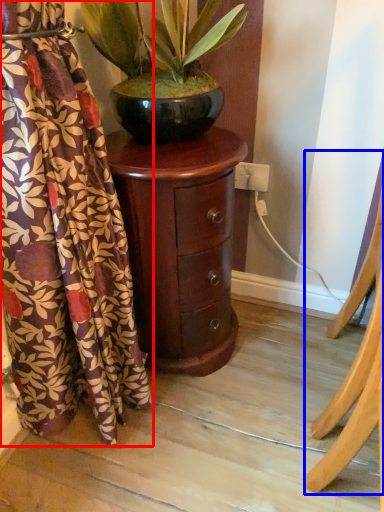
Question: Which point is closer to the camera, curtain (highlighted by a red box) or furniture (highlighted by a blue box)?

Choices:
 (A) curtain
 (B) furniture

Answer: (A)